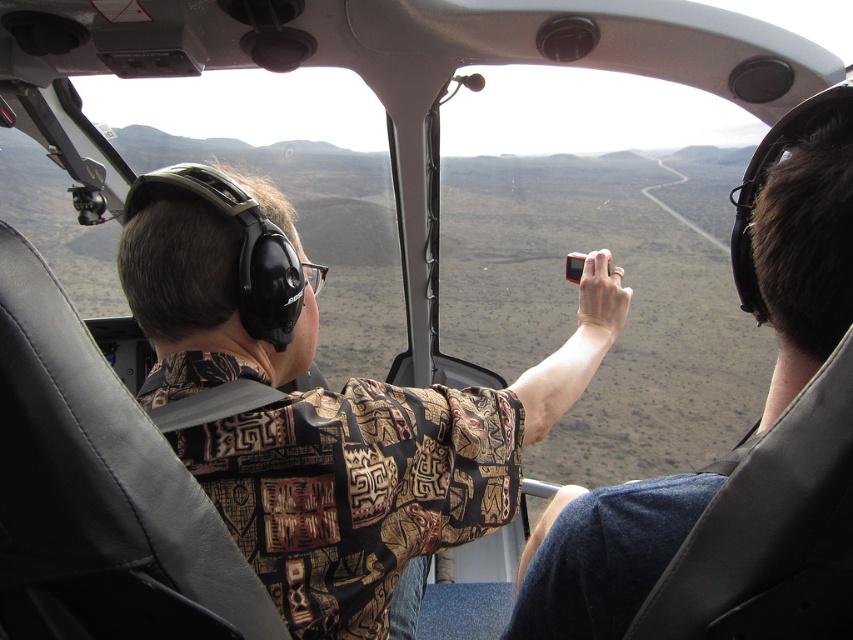
You are a passenger in the helicopter and want to take a photo of the arid landscape outside. You notice two points marked in the cabin. The first point is at coordinate point(314, 541) and the second is at point(560, 628). Which point is closer to the front windshield where the pilot is looking?

Point(314, 541) is further to the camera than point(560, 628). Since the pilot is looking out the front windshield, the point closer to the front would be the one closer to the windshield. However, the description states that point(314, 541) is further from the camera, implying it is farther away from the windshield. Therefore, point(560, 628) is closer to the front windshield.

You are a passenger in the helicopter and want to take a photo of the pilot wearing the patterned fabric shirt at center using the matte black camera at right. Can you do this while facing forward?

The patterned fabric shirt at center is positioned on the left side of the matte black camera at right, so the pilot is to the left of the camera. Since you are facing forward in the helicopter, you would need to turn to your left to position the pilot within the camera frame.